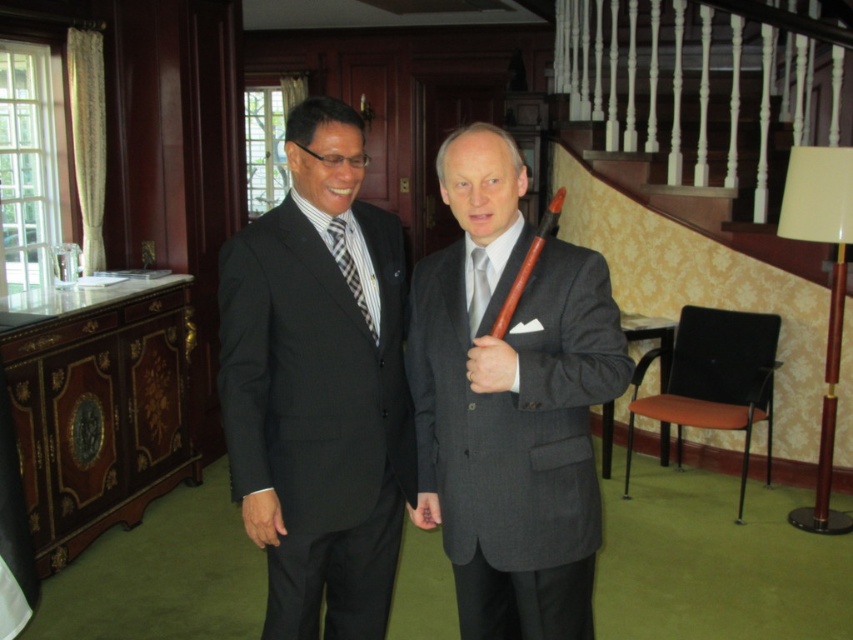
Can you confirm if matte black suit at center is wider than silver silk tie at center?

Yes, matte black suit at center is wider than silver silk tie at center.

Who is more distant from viewer, (354, 298) or (486, 259)?

The point (354, 298) is behind.

Measure the distance between matte black suit at center and camera.

They are 6.61 feet apart.

I want to click on matte black suit at center, so click(x=318, y=385).

This screenshot has width=853, height=640. What do you see at coordinates (509, 404) in the screenshot? I see `gray wool suit at center` at bounding box center [509, 404].

Which is more to the right, gray wool suit at center or black striped tie at center?

gray wool suit at center

Who is more distant from viewer, (438, 156) or (343, 264)?

The point (343, 264) is behind.

The height and width of the screenshot is (640, 853). Identify the location of gray wool suit at center. (509, 404).

Is black striped tie at center bigger than silver silk tie at center?

Yes, black striped tie at center is bigger than silver silk tie at center.

Can you confirm if black striped tie at center is thinner than silver silk tie at center?

No, black striped tie at center is not thinner than silver silk tie at center.

Who is more distant from viewer, (x=341, y=220) or (x=474, y=262)?

Point (x=341, y=220)

Find the location of a particular element. The height and width of the screenshot is (640, 853). black striped tie at center is located at coordinates (349, 269).